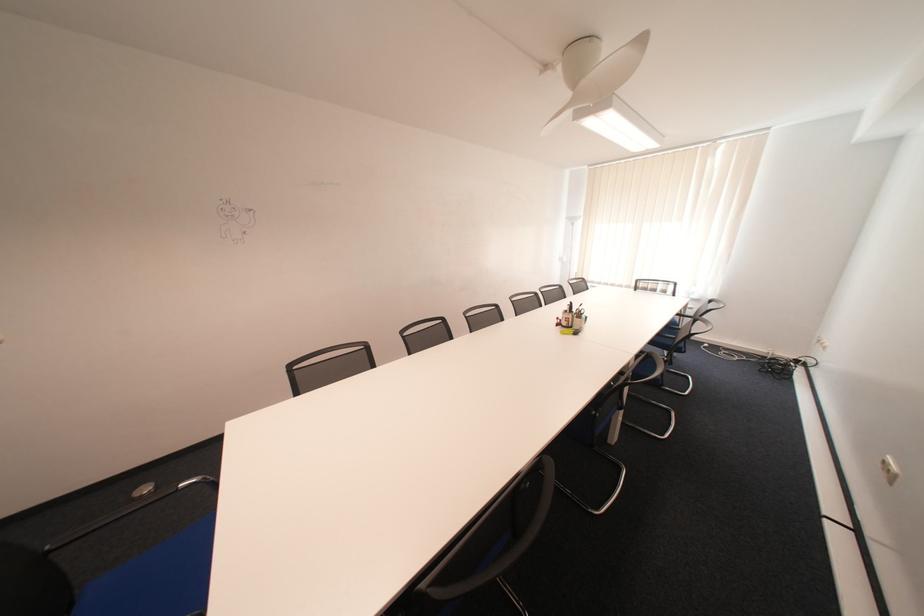
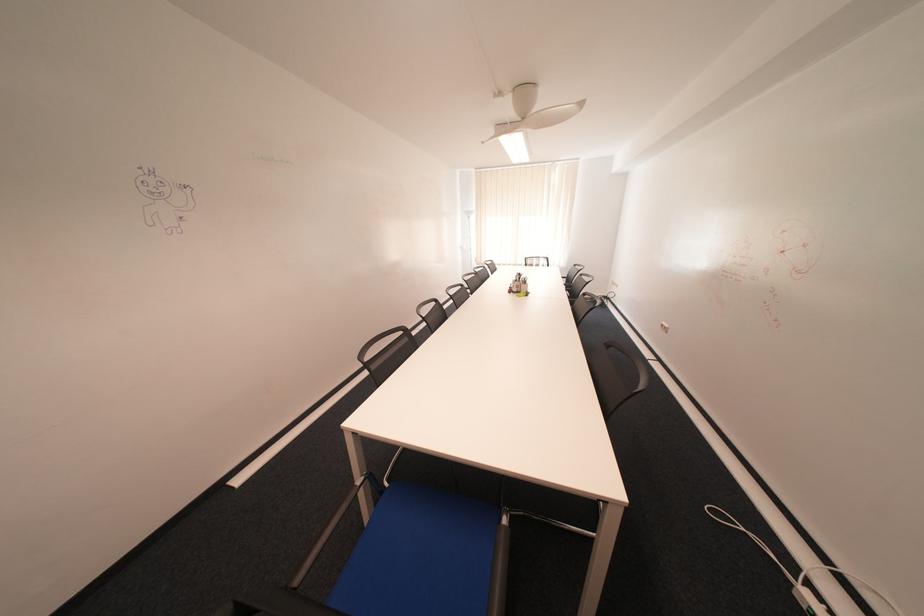
The point at (576,323) is marked in the first image. Where is the corresponding point in the second image?

(526, 290)